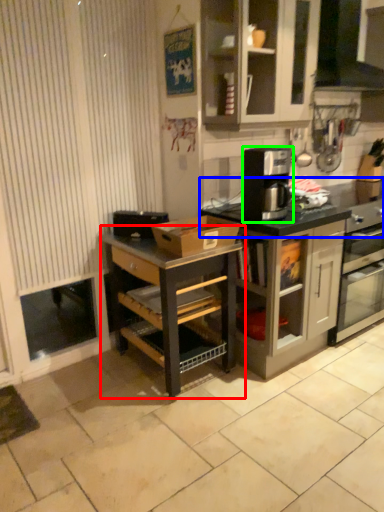
Question: Which object is the closest to the shelf (highlighted by a red box)? Choose among these: countertop (highlighted by a blue box) or kitchen appliance (highlighted by a green box).

Choices:
 (A) countertop
 (B) kitchen appliance

Answer: (B)